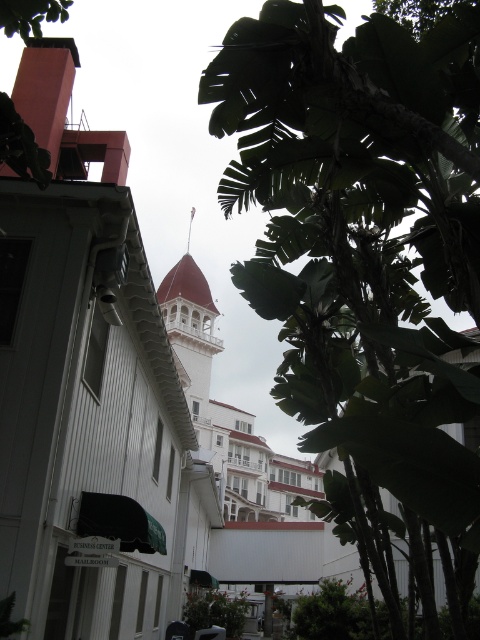
Does point (354, 163) come closer to viewer compared to point (66, 1)?

Yes, point (354, 163) is in front of point (66, 1).

Is green leafy tree at center taller than green leafy tree at upper center?

Yes.

Who is more distant from viewer, (412, 561) or (4, 26)?

The point (4, 26) is behind.

Where is `green leafy tree at center`? The height and width of the screenshot is (640, 480). green leafy tree at center is located at coordinates (367, 262).

Can you confirm if green leafy plant at lower center is positioned to the left of green leafy tree at upper center?

Incorrect, green leafy plant at lower center is not on the left side of green leafy tree at upper center.

Is green leafy plant at lower center in front of green leafy tree at upper center?

No, green leafy plant at lower center is behind green leafy tree at upper center.

You are a GUI agent. You are given a task and a screenshot of the screen. Output one action in this format:
    pyautogui.click(x=<x>, y=<y>)
    Task: Click on the green leafy plant at lower center
    Image resolution: width=480 pixels, height=640 pixels.
    Given the screenshot: What is the action you would take?
    pyautogui.click(x=216, y=611)

Can you confirm if green leafy tree at center is smaller than green leafy plant at lower center?

No, green leafy tree at center is not smaller than green leafy plant at lower center.

Is green leafy tree at center closer to the viewer compared to green leafy plant at lower center?

Yes, it is.

Is point (265, 157) closer to camera compared to point (211, 592)?

Yes, point (265, 157) is in front of point (211, 592).

Locate an element on the screen. This screenshot has width=480, height=640. green leafy tree at center is located at coordinates (367, 262).